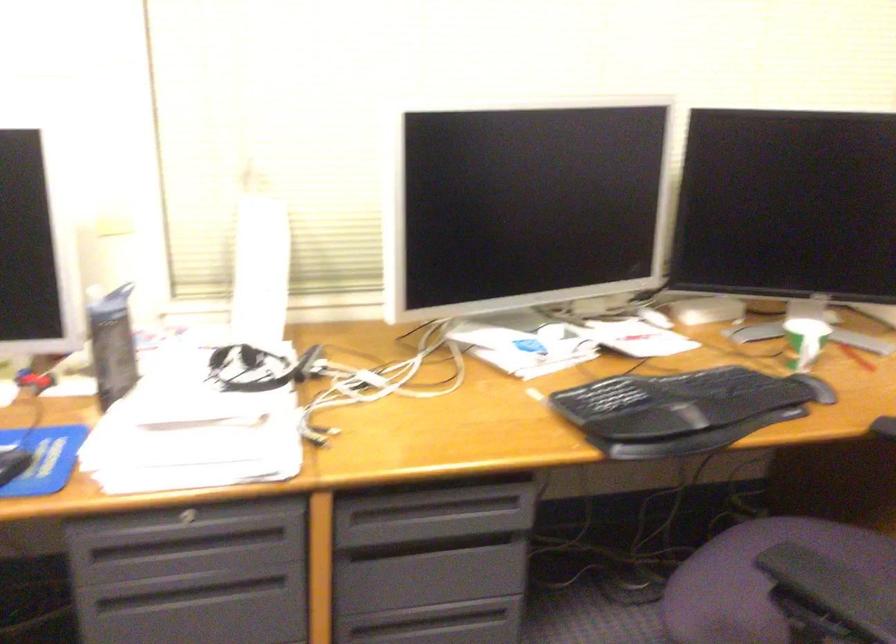
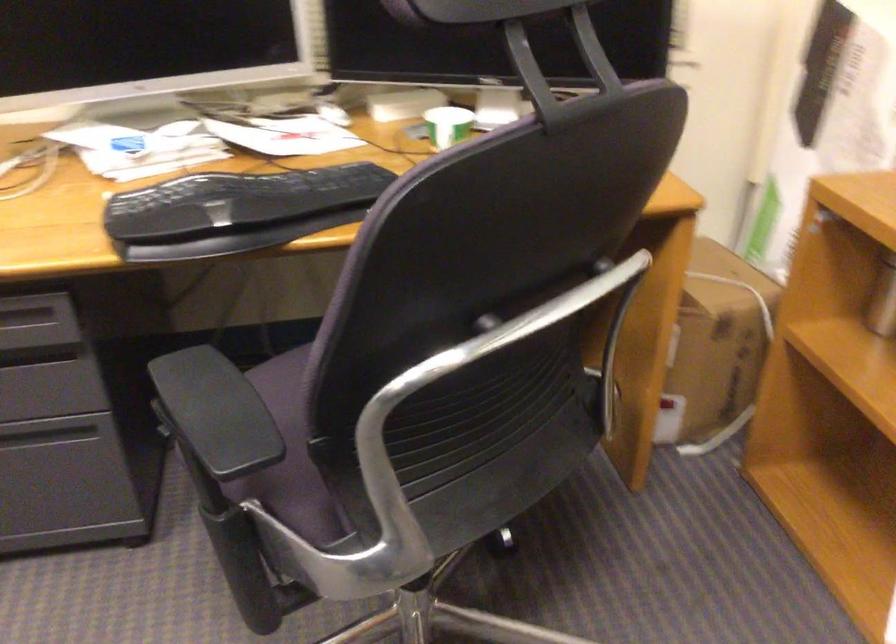
Question: How did the camera likely rotate?

Choices:
 (A) Left
 (B) Right
 (C) Up
 (D) Down

Answer: (D)